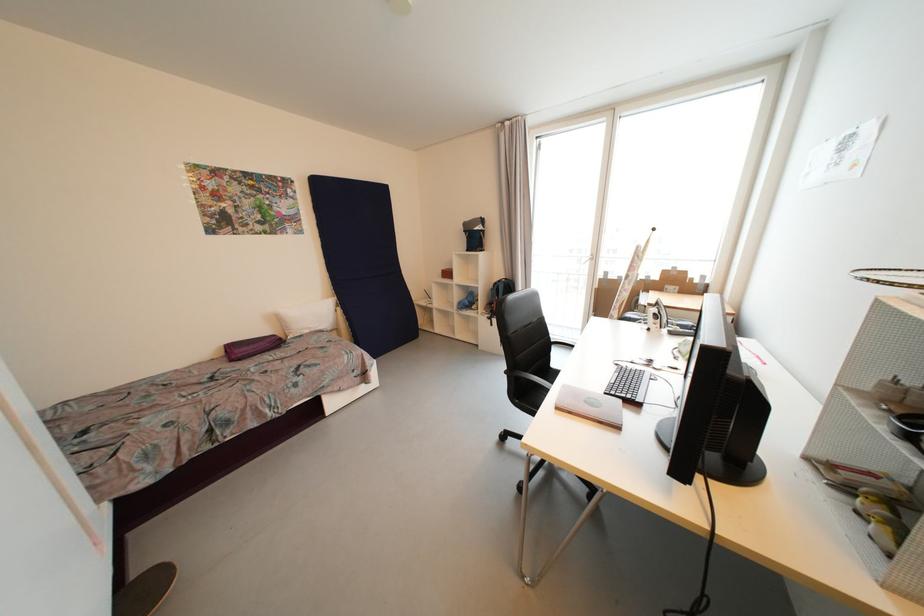
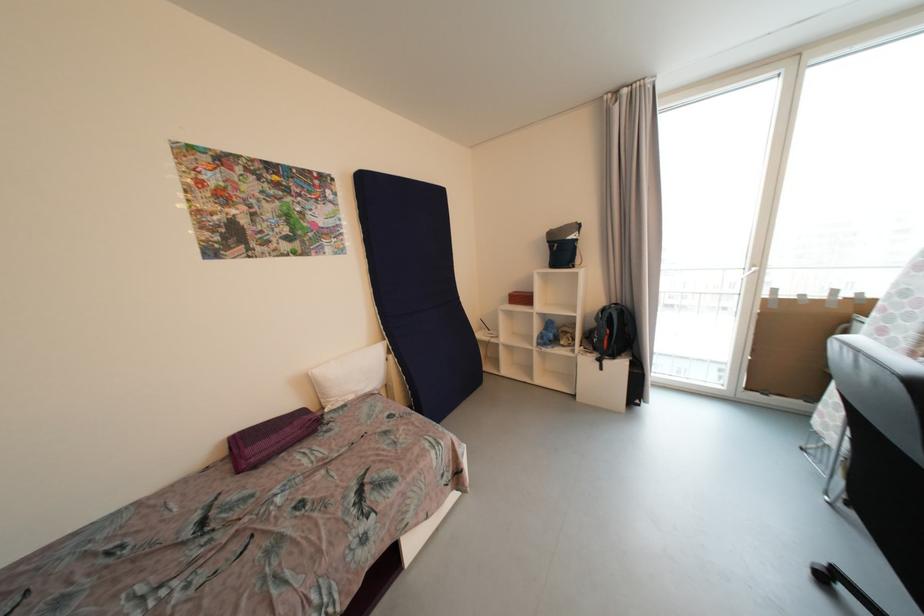
Which direction would the cameraman need to move to produce the second image?

The cameraman moved toward left, forward.